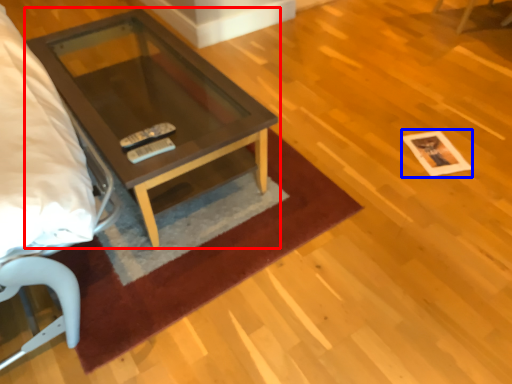
Question: Among these objects, which one is farthest to the camera, coffee table (highlighted by a red box) or square (highlighted by a blue box)?

Choices:
 (A) coffee table
 (B) square

Answer: (B)